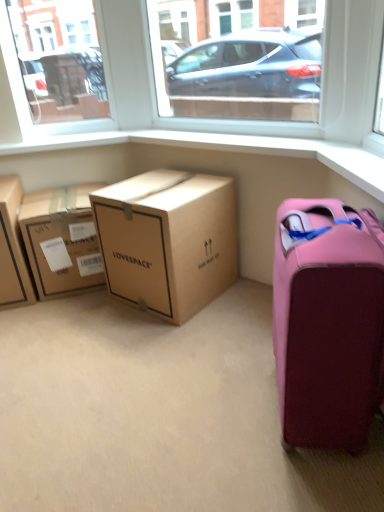
Question: From the image's perspective, would you say matte brown cardboard box at left, the third box from the right, is shown under brown cardboard box at center, which appears as the second box when viewed from the right?

Choices:
 (A) no
 (B) yes

Answer: (B)

Question: From the image's perspective, is matte brown cardboard box at left, arranged as the 1th box when viewed from the left, located above brown cardboard box at center, which is the second box in left-to-right order?

Choices:
 (A) yes
 (B) no

Answer: (B)

Question: Is matte brown cardboard box at left, arranged as the 1th box when viewed from the left, oriented towards brown cardboard box at center, which is the second box in left-to-right order?

Choices:
 (A) no
 (B) yes

Answer: (A)

Question: Is matte brown cardboard box at left, the third box from the right, next to brown cardboard box at center, which is the second box in left-to-right order?

Choices:
 (A) yes
 (B) no

Answer: (B)

Question: From a real-world perspective, is matte brown cardboard box at left, the third box from the right, located beneath brown cardboard box at center, which appears as the second box when viewed from the right?

Choices:
 (A) no
 (B) yes

Answer: (A)

Question: Is matte brown cardboard box at left, arranged as the 1th box when viewed from the left, at the left side of brown cardboard box at center, which appears as the second box when viewed from the right?

Choices:
 (A) yes
 (B) no

Answer: (A)

Question: From the image's perspective, is transparent glass window at upper center, which ranks as the 2th window screen in left-to-right order, on matte brown cardboard box at left, the third box from the right?

Choices:
 (A) no
 (B) yes

Answer: (B)

Question: Is transparent glass window at upper center, which ranks as the first window screen in right-to-left order, positioned far away from matte brown cardboard box at left, the third box from the right?

Choices:
 (A) no
 (B) yes

Answer: (B)

Question: Is matte brown cardboard box at left, the third box from the right, completely or partially inside transparent glass window at upper center, which ranks as the 2th window screen in left-to-right order?

Choices:
 (A) no
 (B) yes

Answer: (A)

Question: Can you confirm if transparent glass window at upper center, which ranks as the 2th window screen in left-to-right order, is smaller than matte brown cardboard box at left, arranged as the 1th box when viewed from the left?

Choices:
 (A) no
 (B) yes

Answer: (B)

Question: Considering the relative sizes of transparent glass window at upper center, which ranks as the first window screen in right-to-left order, and matte brown cardboard box at left, arranged as the 1th box when viewed from the left, in the image provided, is transparent glass window at upper center, which ranks as the first window screen in right-to-left order, thinner than matte brown cardboard box at left, arranged as the 1th box when viewed from the left,?

Choices:
 (A) yes
 (B) no

Answer: (A)

Question: Is transparent glass window at upper center, which ranks as the first window screen in right-to-left order, turned away from matte brown cardboard box at left, arranged as the 1th box when viewed from the left?

Choices:
 (A) no
 (B) yes

Answer: (A)

Question: Is pink matte suitcase at lower right positioned with its back to brown cardboard box at center, which is the second box in left-to-right order?

Choices:
 (A) yes
 (B) no

Answer: (B)